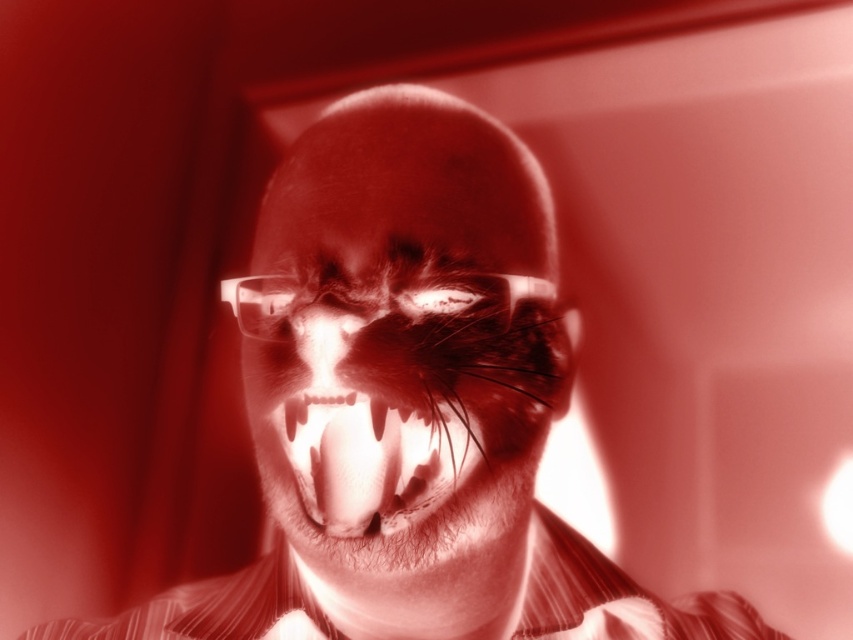
From the picture: You are a photographer adjusting the lighting for a portrait. The subject is wearing a striped cotton dress shirt at center and has a translucent glass nose at center. You need to ensure the lighting highlights both the shirt and the nose equally. Given their distance apart, is this feasible?

The striped cotton dress shirt at center is 22.43 centimeters from the translucent glass nose at center. Since the distance between them is manageable, adjusting the lighting to highlight both equally is feasible by positioning the light source appropriately to cover both areas without creating harsh shadows.

You are a fashion designer looking to create a new outfit. You see the striped cotton dress shirt at center and the translucent glass nose at center in the image. Which item is positioned lower on the person?

The striped cotton dress shirt at center is located below the translucent glass nose at center, so the striped cotton dress shirt at center is positioned lower on the person.

Consider the image. You are a photographer standing 2 feet away from your subject. You want to take a portrait of the striped cotton dress shirt at center. Is the current distance sufficient to capture the entire shirt in the frame?

The striped cotton dress shirt at center is 16.76 inches away from the camera. Since you are standing 2 feet away, which is 24 inches, the shirt is within your camera range. Therefore, the current distance is sufficient to capture the entire shirt in the frame.